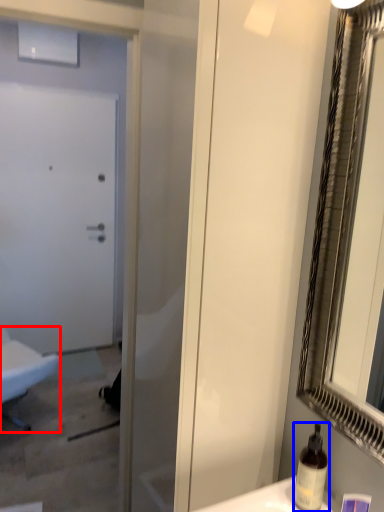
Question: Among these objects, which one is nearest to the camera, furniture (highlighted by a red box) or bottle (highlighted by a blue box)?

Choices:
 (A) furniture
 (B) bottle

Answer: (B)